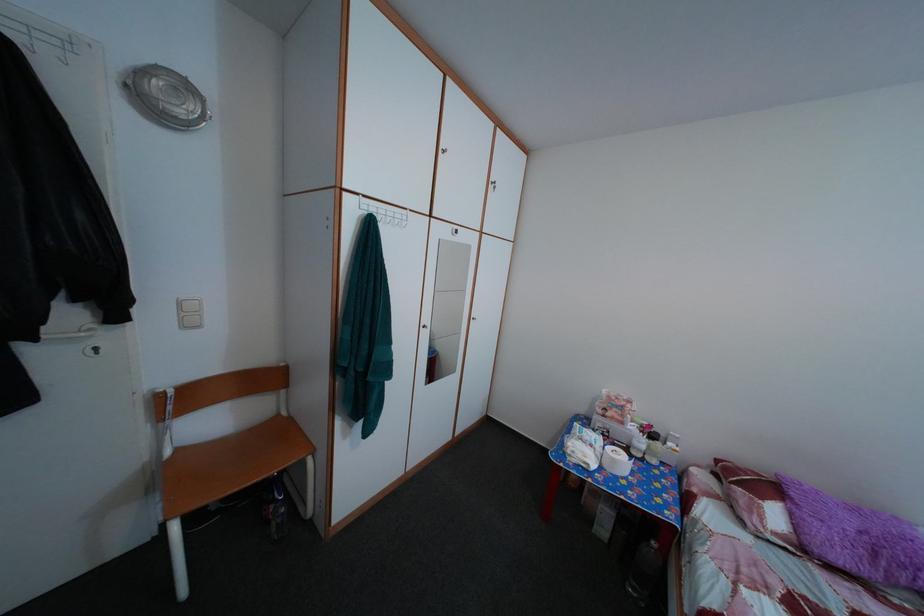
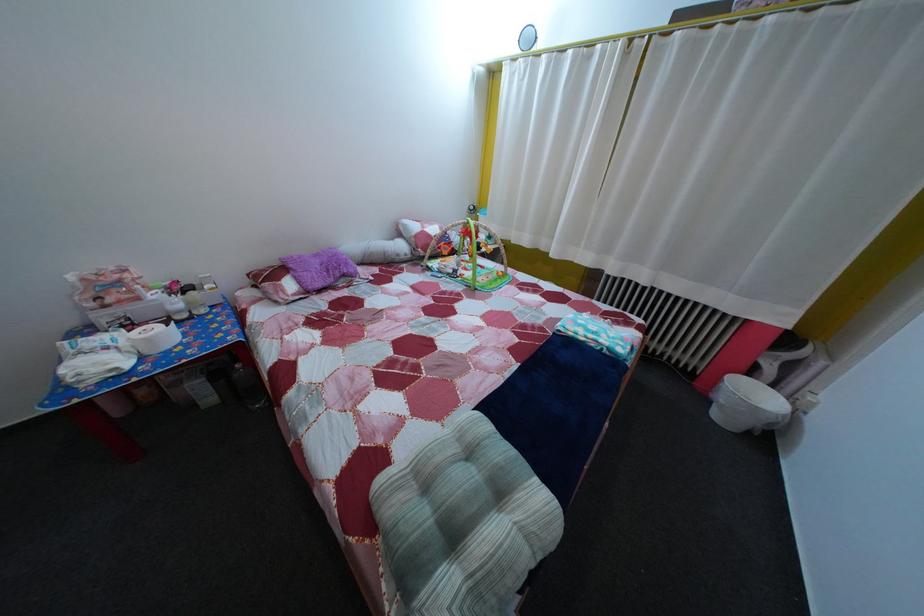
Where in the second image is the point corresponding to point 623,468 from the first image?

(157, 347)